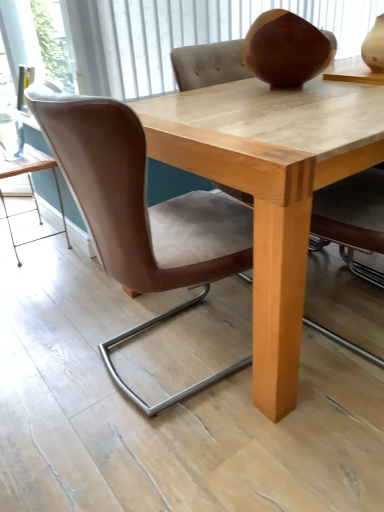
Locate an element on the screen. This screenshot has width=384, height=512. vacant space in front of light brown wood table at lower left is located at coordinates (46, 275).